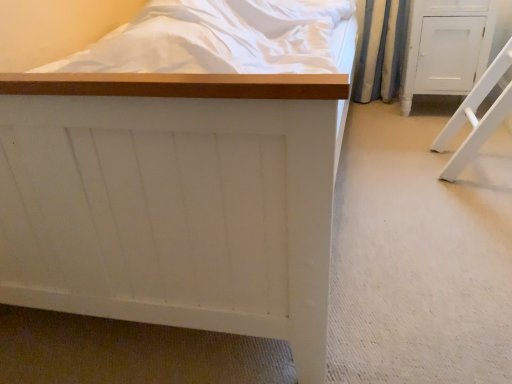
What are the coordinates of `white matte bed at center, which appears as the 2th furniture when viewed from the right` in the screenshot? It's located at (176, 199).

What do you see at coordinates (176, 199) in the screenshot? I see `white matte bed at center, which is the first furniture from left to right` at bounding box center [176, 199].

How much space does white painted wood cabinet at right, the second furniture positioned from the left, occupy horizontally?

32.95 centimeters.

What are the coordinates of `white painted wood cabinet at right, the second furniture positioned from the left` in the screenshot? It's located at (446, 47).

This screenshot has width=512, height=384. Describe the element at coordinates (446, 47) in the screenshot. I see `white painted wood cabinet at right, the second furniture positioned from the left` at that location.

This screenshot has width=512, height=384. I want to click on white matte bed at center, which is the first furniture from left to right, so click(176, 199).

Considering the relative positions of white matte bed at center, which is the first furniture from left to right, and white painted wood cabinet at right, the first furniture when ordered from right to left, in the image provided, is white matte bed at center, which is the first furniture from left to right, to the left of white painted wood cabinet at right, the first furniture when ordered from right to left, from the viewer's perspective?

Correct, you'll find white matte bed at center, which is the first furniture from left to right, to the left of white painted wood cabinet at right, the first furniture when ordered from right to left.

Which object is closer to the camera taking this photo, white matte bed at center, which is the first furniture from left to right, or white painted wood cabinet at right, the second furniture positioned from the left?

white matte bed at center, which is the first furniture from left to right, is in front.

Is point (276, 207) positioned after point (430, 65)?

No, (276, 207) is in front of (430, 65).

From the image's perspective, relative to white painted wood cabinet at right, the first furniture when ordered from right to left, is white matte bed at center, which is the first furniture from left to right, above or below?

Clearly, from the image's perspective, white matte bed at center, which is the first furniture from left to right, is below white painted wood cabinet at right, the first furniture when ordered from right to left.

From a real-world perspective, is white matte bed at center, which appears as the 2th furniture when viewed from the right, under white painted wood cabinet at right, the first furniture when ordered from right to left?

Actually, white matte bed at center, which appears as the 2th furniture when viewed from the right, is physically above white painted wood cabinet at right, the first furniture when ordered from right to left, in the real world.

Between white matte bed at center, which appears as the 2th furniture when viewed from the right, and white painted wood cabinet at right, the second furniture positioned from the left, which one has larger width?

Wider between the two is white matte bed at center, which appears as the 2th furniture when viewed from the right.

Does white matte bed at center, which appears as the 2th furniture when viewed from the right, have a lesser height compared to white painted wood cabinet at right, the second furniture positioned from the left?

No.

Considering the sizes of white matte bed at center, which is the first furniture from left to right, and white painted wood cabinet at right, the second furniture positioned from the left, in the image, is white matte bed at center, which is the first furniture from left to right, bigger or smaller than white painted wood cabinet at right, the second furniture positioned from the left,?

In the image, white matte bed at center, which is the first furniture from left to right, appears to be larger than white painted wood cabinet at right, the second furniture positioned from the left.

Is white matte bed at center, which is the first furniture from left to right, not within white painted wood cabinet at right, the second furniture positioned from the left?

Yes.

Is white matte bed at center, which is the first furniture from left to right, far away from white painted wood cabinet at right, the second furniture positioned from the left?

white matte bed at center, which is the first furniture from left to right, is far away from white painted wood cabinet at right, the second furniture positioned from the left.

Based on the photo, is white matte bed at center, which is the first furniture from left to right, turned away from white painted wood cabinet at right, the first furniture when ordered from right to left?

No, white painted wood cabinet at right, the first furniture when ordered from right to left, is not at the back of white matte bed at center, which is the first furniture from left to right.

Can you tell me how much white matte bed at center, which appears as the 2th furniture when viewed from the right, and white painted wood cabinet at right, the first furniture when ordered from right to left, differ in facing direction?

There is a 1.54-degree angle between the facing directions of white matte bed at center, which appears as the 2th furniture when viewed from the right, and white painted wood cabinet at right, the first furniture when ordered from right to left.

Measure the distance between white matte bed at center, which is the first furniture from left to right, and white painted wood cabinet at right, the second furniture positioned from the left.

white matte bed at center, which is the first furniture from left to right, and white painted wood cabinet at right, the second furniture positioned from the left, are 5.66 feet apart.

You are a GUI agent. You are given a task and a screenshot of the screen. Output one action in this format:
    pyautogui.click(x=<x>, y=<y>)
    Task: Click on the furniture lying below the white painted wood cabinet at right, the first furniture when ordered from right to left (from the image's perspective)
    
    Given the screenshot: What is the action you would take?
    pos(176,199)

Which is more to the right, white painted wood cabinet at right, the first furniture when ordered from right to left, or white matte bed at center, which appears as the 2th furniture when viewed from the right?

From the viewer's perspective, white painted wood cabinet at right, the first furniture when ordered from right to left, appears more on the right side.

Is the position of white painted wood cabinet at right, the second furniture positioned from the left, less distant than that of white matte bed at center, which appears as the 2th furniture when viewed from the right?

That is False.

Which point is more distant from viewer, (462,5) or (266,169)?

Positioned behind is point (462,5).

From the picture: From the image's perspective, is white painted wood cabinet at right, the first furniture when ordered from right to left, above or below white matte bed at center, which appears as the 2th furniture when viewed from the right?

Clearly, from the image's perspective, white painted wood cabinet at right, the first furniture when ordered from right to left, is above white matte bed at center, which appears as the 2th furniture when viewed from the right.

From a real-world perspective, who is located lower, white painted wood cabinet at right, the first furniture when ordered from right to left, or white matte bed at center, which is the first furniture from left to right?

white painted wood cabinet at right, the first furniture when ordered from right to left, is physically lower.

Considering the relative sizes of white painted wood cabinet at right, the second furniture positioned from the left, and white matte bed at center, which appears as the 2th furniture when viewed from the right, in the image provided, is white painted wood cabinet at right, the second furniture positioned from the left, thinner than white matte bed at center, which appears as the 2th furniture when viewed from the right,?

Yes, white painted wood cabinet at right, the second furniture positioned from the left, is thinner than white matte bed at center, which appears as the 2th furniture when viewed from the right.

Considering the relative sizes of white painted wood cabinet at right, the second furniture positioned from the left, and white matte bed at center, which is the first furniture from left to right, in the image provided, is white painted wood cabinet at right, the second furniture positioned from the left, shorter than white matte bed at center, which is the first furniture from left to right,?

Indeed, white painted wood cabinet at right, the second furniture positioned from the left, has a lesser height compared to white matte bed at center, which is the first furniture from left to right.

Based on the photo, between white painted wood cabinet at right, the second furniture positioned from the left, and white matte bed at center, which appears as the 2th furniture when viewed from the right, which one has smaller size?

With smaller size is white painted wood cabinet at right, the second furniture positioned from the left.

Do you think white painted wood cabinet at right, the first furniture when ordered from right to left, is within white matte bed at center, which is the first furniture from left to right, or outside of it?

white painted wood cabinet at right, the first furniture when ordered from right to left, is not enclosed by white matte bed at center, which is the first furniture from left to right.

Is white painted wood cabinet at right, the second furniture positioned from the left, far away from white matte bed at center, which is the first furniture from left to right?

Yes, white painted wood cabinet at right, the second furniture positioned from the left, is far from white matte bed at center, which is the first furniture from left to right.

Is white painted wood cabinet at right, the second furniture positioned from the left, positioned with its back to white matte bed at center, which appears as the 2th furniture when viewed from the right?

That's not correct — white painted wood cabinet at right, the second furniture positioned from the left, is not looking away from white matte bed at center, which appears as the 2th furniture when viewed from the right.

The width and height of the screenshot is (512, 384). I want to click on furniture that is behind the white matte bed at center, which is the first furniture from left to right, so [446, 47].

This screenshot has width=512, height=384. In the image, there is a white matte bed at center, which is the first furniture from left to right. In order to click on furniture above it (from the image's perspective) in this screenshot , I will do `click(446, 47)`.

Identify the location of furniture below the white painted wood cabinet at right, the first furniture when ordered from right to left (from the image's perspective). (176, 199).